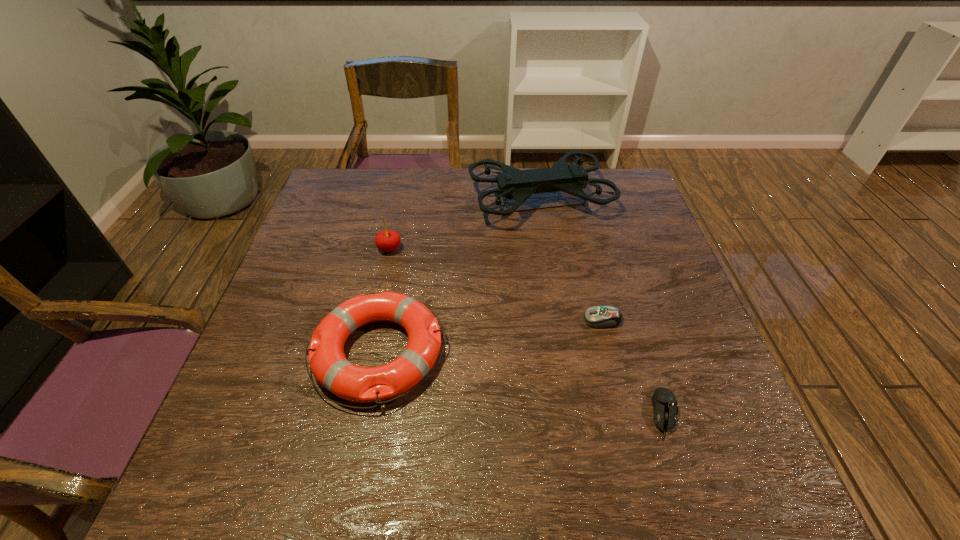
The image size is (960, 540). I want to click on the tallest object, so click(516, 184).

Where is `drone`? This screenshot has height=540, width=960. drone is located at coordinates (516, 184).

Where is `the fourth nearest object`? The height and width of the screenshot is (540, 960). the fourth nearest object is located at coordinates (388, 240).

Locate an element on the screen. Image resolution: width=960 pixels, height=540 pixels. cherry is located at coordinates (388, 240).

Where is `life buoy`? The height and width of the screenshot is (540, 960). life buoy is located at coordinates (329, 365).

The image size is (960, 540). I want to click on the farther computer mouse, so click(596, 316).

Locate an element on the screen. the nearer computer mouse is located at coordinates (665, 407).

The height and width of the screenshot is (540, 960). I want to click on the shortest object, so click(x=665, y=407).

You are a GUI agent. You are given a task and a screenshot of the screen. Output one action in this format:
    pyautogui.click(x=<x>, y=<y>)
    Task: Click on the vacant point located 0.190m on the left of the drone
    The width and height of the screenshot is (960, 540).
    Given the screenshot: What is the action you would take?
    pyautogui.click(x=405, y=199)

The width and height of the screenshot is (960, 540). Identify the location of free space located 0.200m on the left of the fourth shortest object. pyautogui.click(x=301, y=249).